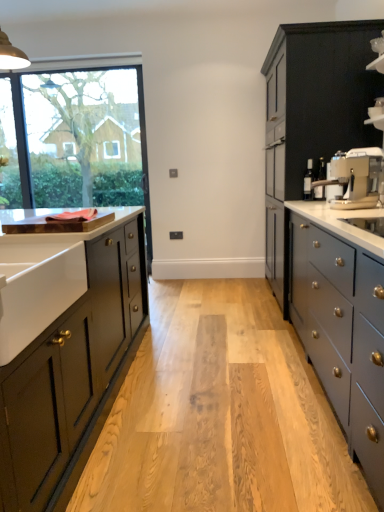
At what (x,y) coordinates should I click in order to perform the action: click on matte black cabinet at right, acting as the first cabinetry starting from the back. Please return your answer as a coordinate pair (x, y). The image size is (384, 512). Looking at the image, I should click on (314, 112).

Is matte black cabinet at left, the second cabinetry from the right, shorter than brown wood cutting board at left?

In fact, matte black cabinet at left, the second cabinetry from the right, may be taller than brown wood cutting board at left.

Are matte black cabinet at left, the 2th cabinetry positioned from the back, and brown wood cutting board at left making contact?

No.

Is brown wood cutting board at left at the back of matte black cabinet at left, the 2th cabinetry positioned from the back?

No.

Identify the location of cabinetry below the matte gray countertop at right (from a real-world perspective). This screenshot has width=384, height=512. click(x=62, y=344).

Considering the relative sizes of matte gray countertop at right and matte black cabinet at left, the first cabinetry viewed from the left, in the image provided, is matte gray countertop at right shorter than matte black cabinet at left, the first cabinetry viewed from the left,?

In fact, matte gray countertop at right may be taller than matte black cabinet at left, the first cabinetry viewed from the left.

Are matte gray countertop at right and matte black cabinet at left, the second cabinetry from the right, far apart?

Yes, matte gray countertop at right and matte black cabinet at left, the second cabinetry from the right, are quite far apart.

Between matte gray countertop at right and matte black cabinet at left, the 1th cabinetry viewed from the front, which one has larger size?

matte black cabinet at left, the 1th cabinetry viewed from the front.

From the image's perspective, which object appears higher, matte black cabinet at right, the second cabinetry when ordered from front to back, or clear glass window at upper left?

clear glass window at upper left is shown above in the image.

Looking at their sizes, would you say matte black cabinet at right, the 1th cabinetry from the right, is wider or thinner than clear glass window at upper left?

Clearly, matte black cabinet at right, the 1th cabinetry from the right, has more width compared to clear glass window at upper left.

Considering the positions of objects matte black cabinet at right, the 1th cabinetry from the right, and clear glass window at upper left in the image provided, who is more to the right, matte black cabinet at right, the 1th cabinetry from the right, or clear glass window at upper left?

matte black cabinet at right, the 1th cabinetry from the right, is more to the right.

From a real-world perspective, is matte black cabinet at right, the second cabinetry when ordered from front to back, located higher than clear glass window at upper left?

No, from a real-world perspective, matte black cabinet at right, the second cabinetry when ordered from front to back, is not on top of clear glass window at upper left.

From the image's perspective, is brown wood cutting board at left located beneath clear glass window at upper left?

Indeed, from the image's perspective, brown wood cutting board at left is shown beneath clear glass window at upper left.

Considering the sizes of brown wood cutting board at left and clear glass window at upper left in the image, is brown wood cutting board at left taller or shorter than clear glass window at upper left?

Clearly, brown wood cutting board at left is shorter compared to clear glass window at upper left.

Is brown wood cutting board at left looking in the opposite direction of clear glass window at upper left?

brown wood cutting board at left is not turned away from clear glass window at upper left.

Does brown wood cutting board at left have a lesser width compared to clear glass window at upper left?

No, brown wood cutting board at left is not thinner than clear glass window at upper left.

From the picture: Is brown wood cutting board at left positioned beyond the bounds of matte gray countertop at right?

That's correct, brown wood cutting board at left is outside of matte gray countertop at right.

From the image's perspective, which is below, brown wood cutting board at left or matte gray countertop at right?

matte gray countertop at right, from the image's perspective.

Measure the distance between brown wood cutting board at left and matte gray countertop at right.

brown wood cutting board at left is 1.21 meters away from matte gray countertop at right.

Is brown wood cutting board at left closer to camera compared to matte gray countertop at right?

No, brown wood cutting board at left is further to the viewer.

Measure the distance from white ceramic sink at left to brown wood cutting board at left.

white ceramic sink at left is 17.10 inches away from brown wood cutting board at left.

Locate an element on the screen. sink below the brown wood cutting board at left (from the image's perspective) is located at coordinates (36, 289).

In the image, is white ceramic sink at left positioned in front of or behind brown wood cutting board at left?

Clearly, white ceramic sink at left is in front of brown wood cutting board at left.

Based on the photo, how different are the orientations of white ceramic sink at left and brown wood cutting board at left in degrees?

There is a 179-degree angle between the facing directions of white ceramic sink at left and brown wood cutting board at left.

From the image's perspective, would you say white ceramic sink at left is positioned over matte black cabinet at right, acting as the first cabinetry starting from the back?

No, from the image's perspective, white ceramic sink at left is not above matte black cabinet at right, acting as the first cabinetry starting from the back.

How far apart are white ceramic sink at left and matte black cabinet at right, the 1th cabinetry from the right?

white ceramic sink at left and matte black cabinet at right, the 1th cabinetry from the right, are 2.14 meters apart from each other.

Is the position of white ceramic sink at left less distant than that of matte black cabinet at right, acting as the first cabinetry starting from the back?

Yes.

Is white ceramic sink at left shorter than matte black cabinet at right, the second cabinetry when ordered from front to back?

Indeed, white ceramic sink at left has a lesser height compared to matte black cabinet at right, the second cabinetry when ordered from front to back.

I want to click on cabinetry that is below the brown wood cutting board at left (from the image's perspective), so click(62, 344).

I want to click on counter located above the matte black cabinet at left, the second cabinetry from the right (from the image's perspective), so click(x=342, y=324).

Which object lies further to the anchor point satin silver coffee machine at right, matte black cabinet at right, the second cabinetry when ordered from front to back, or matte black cabinet at left, the first cabinetry viewed from the left?

matte black cabinet at left, the first cabinetry viewed from the left, is positioned further to the anchor satin silver coffee machine at right.

Which object lies nearer to the anchor point matte black cabinet at right, acting as the first cabinetry starting from the back, clear glass window at upper left or matte gray countertop at right?

matte gray countertop at right is positioned closer to the anchor matte black cabinet at right, acting as the first cabinetry starting from the back.

Estimate the real-world distances between objects in this image. Which object is closer to clear glass window at upper left, white ceramic sink at left or brown wood cutting board at left?

brown wood cutting board at left lies closer to clear glass window at upper left than the other object.

Looking at the image, which one is located further to white ceramic sink at left, brown wood cutting board at left or satin silver coffee machine at right?

The object further to white ceramic sink at left is satin silver coffee machine at right.

Based on the photo, when comparing their distances from matte black cabinet at left, the second cabinetry from the right, does clear glass window at upper left or matte black cabinet at right, positioned as the second cabinetry in left-to-right order, seem further?

clear glass window at upper left is further to matte black cabinet at left, the second cabinetry from the right.

Looking at the image, which one is located closer to matte black cabinet at left, the second cabinetry from the right, matte black cabinet at right, acting as the first cabinetry starting from the back, or clear glass window at upper left?

matte black cabinet at right, acting as the first cabinetry starting from the back, lies closer to matte black cabinet at left, the second cabinetry from the right, than the other object.

Which object lies nearer to the anchor point matte black cabinet at right, positioned as the second cabinetry in left-to-right order, white ceramic sink at left or clear glass window at upper left?

white ceramic sink at left.

Considering their positions, is clear glass window at upper left positioned closer to matte black cabinet at right, the second cabinetry when ordered from front to back, than brown wood cutting board at left?

brown wood cutting board at left is closer to matte black cabinet at right, the second cabinetry when ordered from front to back.

What are the coordinates of `sink between matte black cabinet at left, the 2th cabinetry positioned from the back, and clear glass window at upper left, along the z-axis` in the screenshot? It's located at (36, 289).

The width and height of the screenshot is (384, 512). In order to click on coffee machine between white ceramic sink at left and clear glass window at upper left along the z-axis in this screenshot , I will do `click(358, 178)`.

Identify the location of countertop located between white ceramic sink at left and matte black cabinet at right, the second cabinetry when ordered from front to back, in the left-right direction. (61, 223).

The height and width of the screenshot is (512, 384). In order to click on countertop between matte black cabinet at left, the second cabinetry from the right, and matte black cabinet at right, the 1th cabinetry from the right, in the horizontal direction in this screenshot , I will do `click(61, 223)`.